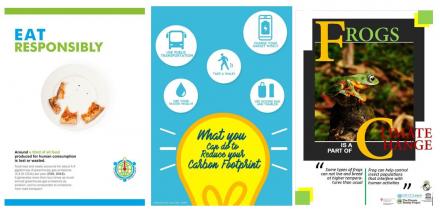
I want to click on plate, so click(86, 92).